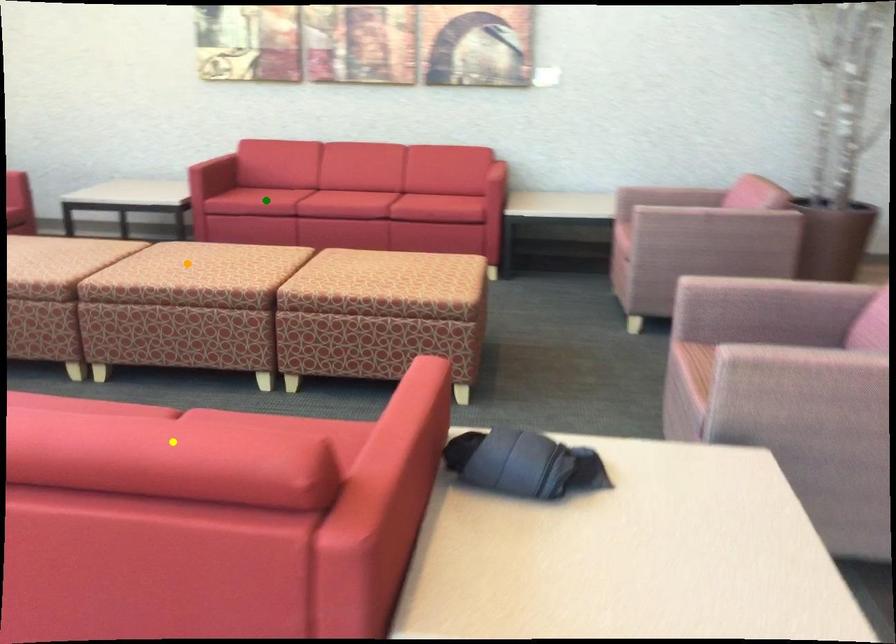
In the scene shown: Order these from nearest to farthest:
A) green point
B) orange point
C) yellow point

yellow point, orange point, green point